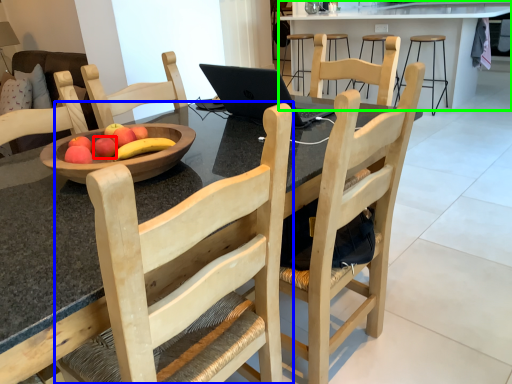
Question: Considering the real-world distances, which object is closest to apple (highlighted by a red box)? chair (highlighted by a blue box) or table (highlighted by a green box).

Choices:
 (A) chair
 (B) table

Answer: (A)